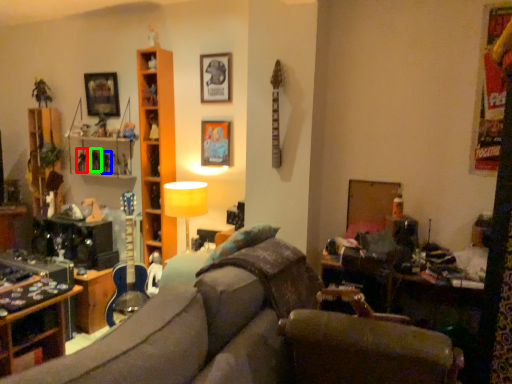
Question: Estimate the real-world distances between objects in this image. Which object is closer to toy (highlighted by a red box), toy (highlighted by a blue box) or toy (highlighted by a green box)?

Choices:
 (A) toy
 (B) toy

Answer: (B)